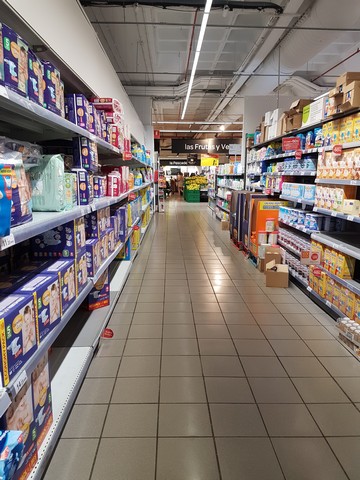
At what (x,y) coordinates should I click in order to perform the action: click on 1 empty shelf. Please return your answer as a coordinate pair (x, y). The height and width of the screenshot is (480, 360). Looking at the image, I should click on (349, 240).